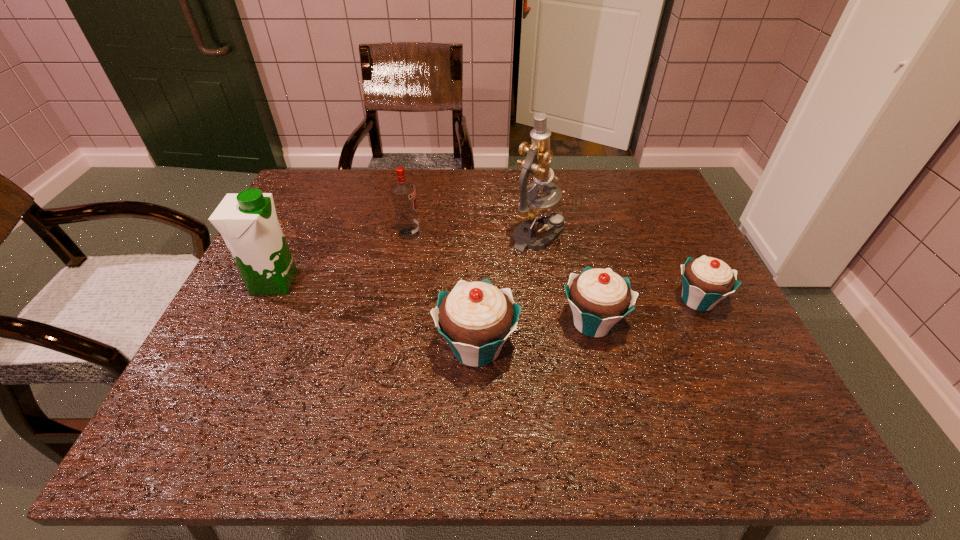
Where is `the third object from left to right`? the third object from left to right is located at coordinates (476, 318).

You are a GUI agent. You are given a task and a screenshot of the screen. Output one action in this format:
    pyautogui.click(x=<x>, y=<y>)
    Task: Click on the second shortest object
    
    Given the screenshot: What is the action you would take?
    pyautogui.click(x=599, y=298)

Where is `the second cupcake from left to right`? the second cupcake from left to right is located at coordinates (599, 298).

Find the location of a particular element. The image size is (960, 540). the rightmost object is located at coordinates click(x=706, y=281).

Locate an element on the screen. Image resolution: width=960 pixels, height=540 pixels. the rightmost cupcake is located at coordinates (706, 281).

Where is `microscope`? microscope is located at coordinates (532, 208).

This screenshot has height=540, width=960. I want to click on the fifth object from right to left, so click(x=403, y=193).

Find the location of a particular element. Image resolution: width=960 pixels, height=540 pixels. the fifth shortest object is located at coordinates (248, 223).

Image resolution: width=960 pixels, height=540 pixels. In order to click on the leftmost object in this screenshot , I will do `click(248, 223)`.

Where is `free spot located on the back of the leftmost cupcake`? This screenshot has height=540, width=960. free spot located on the back of the leftmost cupcake is located at coordinates click(x=477, y=262).